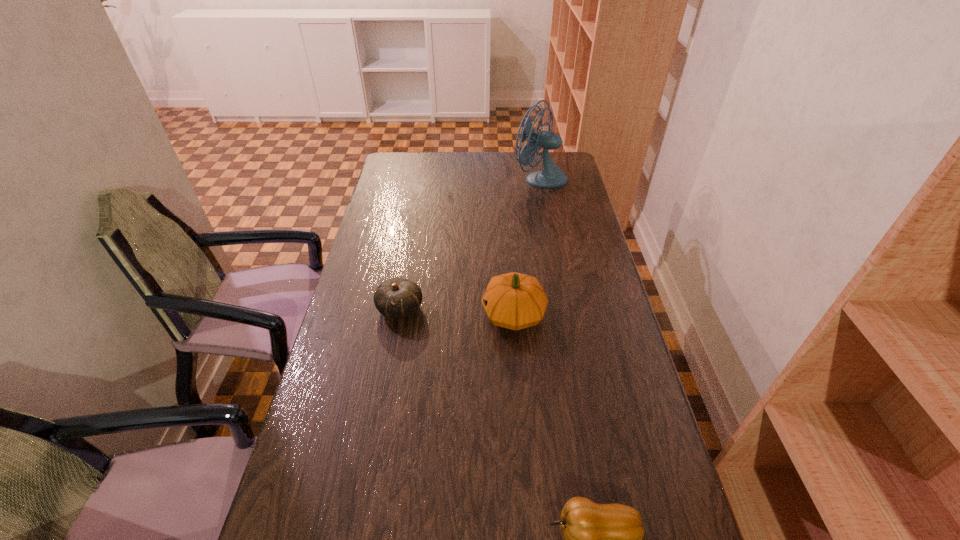
Identify the location of the tallest object. (551, 176).

The image size is (960, 540). In order to click on the farthest object in this screenshot , I will do `click(551, 176)`.

What are the coordinates of `the tallest gourd` in the screenshot? It's located at (515, 301).

At what (x,y) coordinates should I click in order to perform the action: click on the leftmost object. Please return your answer as a coordinate pair (x, y). The image size is (960, 540). Looking at the image, I should click on (397, 297).

Identify the location of free region located in front of the tallest object to blow air. Image resolution: width=960 pixels, height=540 pixels. [468, 178].

You are a GUI agent. You are given a task and a screenshot of the screen. Output one action in this format:
    pyautogui.click(x=<x>, y=<y>)
    Task: Click on the vacant space located in front of the tallest object to blow air
    This screenshot has width=960, height=540.
    Given the screenshot: What is the action you would take?
    pyautogui.click(x=444, y=178)

Find the location of a particular element. The image size is (960, 540). free space located in front of the tallest object to blow air is located at coordinates (463, 178).

Locate an element on the screen. Image resolution: width=960 pixels, height=540 pixels. free spot located 0.150m on the side of the third shortest object with the carved face is located at coordinates (433, 314).

The image size is (960, 540). I want to click on vacant region located 0.170m on the side of the third shortest object with the carved face, so click(x=426, y=314).

Where is `free space located on the side of the third shortest object with the carved face`? This screenshot has height=540, width=960. free space located on the side of the third shortest object with the carved face is located at coordinates (423, 314).